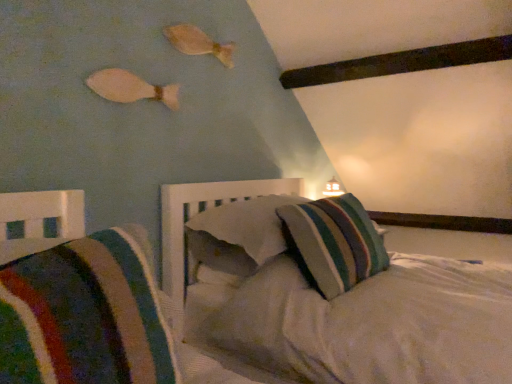
Question: Does striped fabric pillow at center, which is the 1th pillow in front-to-back order, appear on the right side of striped fabric pillow at center, placed as the first pillow when sorted from back to front?

Choices:
 (A) yes
 (B) no

Answer: (B)

Question: Is striped fabric pillow at center, which ranks as the third pillow in back-to-front order, at the left side of striped fabric pillow at center, marked as the 3th pillow in a front-to-back arrangement?

Choices:
 (A) no
 (B) yes

Answer: (B)

Question: From a real-world perspective, is striped fabric pillow at center, which ranks as the third pillow in back-to-front order, beneath striped fabric pillow at center, placed as the first pillow when sorted from back to front?

Choices:
 (A) yes
 (B) no

Answer: (A)

Question: Can you confirm if striped fabric pillow at center, which is the 1th pillow in front-to-back order, is wider than striped fabric pillow at center, marked as the 3th pillow in a front-to-back arrangement?

Choices:
 (A) no
 (B) yes

Answer: (A)

Question: Is striped fabric pillow at center, which is the 1th pillow in front-to-back order, closer to camera compared to striped fabric pillow at center, marked as the 3th pillow in a front-to-back arrangement?

Choices:
 (A) yes
 (B) no

Answer: (A)

Question: Is striped fabric pillow at center, which is the 1th pillow in front-to-back order, positioned with its back to striped fabric pillow at center, placed as the first pillow when sorted from back to front?

Choices:
 (A) yes
 (B) no

Answer: (A)

Question: Can you confirm if white matte fish at upper left, the first fish when ordered from front to back, is bigger than striped fabric pillow at center, marked as the 3th pillow in a front-to-back arrangement?

Choices:
 (A) no
 (B) yes

Answer: (A)

Question: Can you confirm if white matte fish at upper left, which is counted as the first fish, starting from the bottom, is shorter than striped fabric pillow at center, placed as the first pillow when sorted from back to front?

Choices:
 (A) yes
 (B) no

Answer: (A)

Question: Considering the relative positions of white matte fish at upper left, which is counted as the 2th fish, starting from the top, and striped fabric pillow at center, placed as the first pillow when sorted from back to front, in the image provided, is white matte fish at upper left, which is counted as the 2th fish, starting from the top, in front of striped fabric pillow at center, placed as the first pillow when sorted from back to front,?

Choices:
 (A) no
 (B) yes

Answer: (A)

Question: Is white matte fish at upper left, the 2th fish positioned from the right, wider than striped fabric pillow at center, marked as the 3th pillow in a front-to-back arrangement?

Choices:
 (A) yes
 (B) no

Answer: (B)

Question: Is striped fabric pillow at center, marked as the 3th pillow in a front-to-back arrangement, located within white matte fish at upper left, the first fish when ordered from front to back?

Choices:
 (A) no
 (B) yes

Answer: (A)

Question: Is white matte fish at upper left, the first fish when ordered from front to back, positioned with its back to striped fabric pillow at center, marked as the 3th pillow in a front-to-back arrangement?

Choices:
 (A) yes
 (B) no

Answer: (B)

Question: From the image's perspective, is white matte fish at upper left, which is counted as the 2th fish, starting from the top, located above striped fabric pillow at center, which is the second pillow in back-to-front order?

Choices:
 (A) yes
 (B) no

Answer: (A)